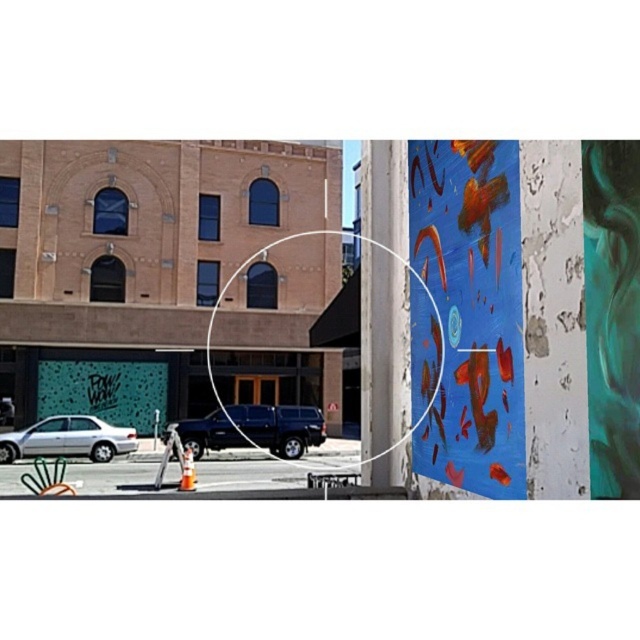
Question: Is blue painted canvas at right below shiny black suv at center?

Choices:
 (A) no
 (B) yes

Answer: (A)

Question: Observing the image, what is the correct spatial positioning of shiny black suv at center in reference to silver metallic car at lower left?

Choices:
 (A) above
 (B) below

Answer: (A)

Question: Which of the following is the closest to the observer?

Choices:
 (A) silver metallic car at lower left
 (B) shiny black suv at center
 (C) blue painted canvas at right

Answer: (C)

Question: Which of the following is the farthest from the observer?

Choices:
 (A) silver metallic car at lower left
 (B) shiny black suv at center

Answer: (B)

Question: Does shiny black suv at center come in front of silver metallic car at lower left?

Choices:
 (A) yes
 (B) no

Answer: (B)

Question: Which point is farther to the camera?

Choices:
 (A) (436, 276)
 (B) (51, 417)

Answer: (B)